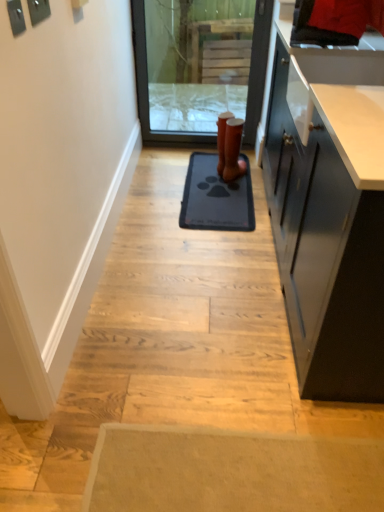
You are a GUI agent. You are given a task and a screenshot of the screen. Output one action in this format:
    pyautogui.click(x=<x>, y=<y>)
    Task: Click on the vacant space in front of gray rubber mat at center
    The height and width of the screenshot is (512, 384).
    Given the screenshot: What is the action you would take?
    pyautogui.click(x=200, y=253)